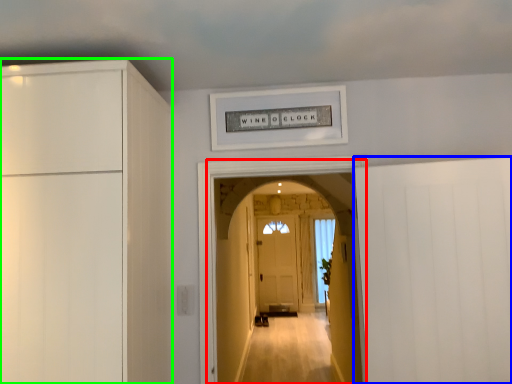
Question: Which object is the closest to the corridor (highlighted by a red box)? Choose among these: door (highlighted by a blue box) or cabinetry (highlighted by a green box).

Choices:
 (A) door
 (B) cabinetry

Answer: (A)